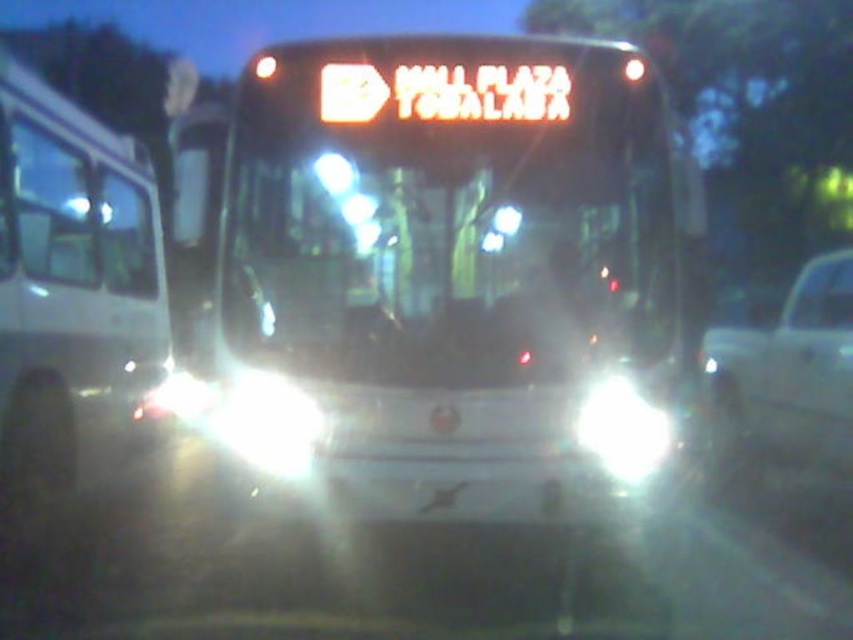
You are a delivery driver who needs to park your van in a parking lot that has a white glossy bus at center. The parking spot you want is directly behind the bus. According to the coordinates provided, can you safely park your van there?

The white glossy bus at center is located at point (457,259). Since the parking spot is directly behind it, you need to ensure there is enough space. However, the coordinates alone do not provide information about the available space behind the bus. You should check the distance between the bus and the end of the parking spot before deciding to park there.

You are a photographer trying to capture the two white glossy buses in the scene. The white glossy bus at center and the white glossy bus at left are both in your viewfinder. Based on their heights, which one should you zoom in on to ensure the entire bus fits in the frame without cropping the top?

The white glossy bus at center is not as tall as the white glossy bus at left, so you should zoom in on the white glossy bus at left to ensure the entire bus fits in the frame without cropping the top.

Looking at this image, you are a delivery driver who needs to park your truck near the white glossy bus at center. The parking spot is located at coordinate point 0.406, 0.538. Can you park your truck there?

The white glossy bus at center is already positioned at point (457, 259), so the parking spot is occupied by the bus and cannot be used for parking.